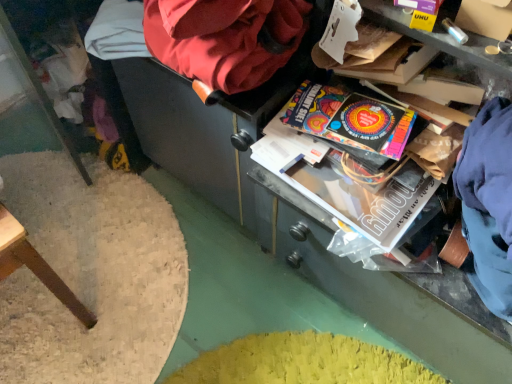
Locate an element on the screen. This screenshot has width=512, height=384. vacant space in front of vibrant paper at center is located at coordinates coord(358,195).